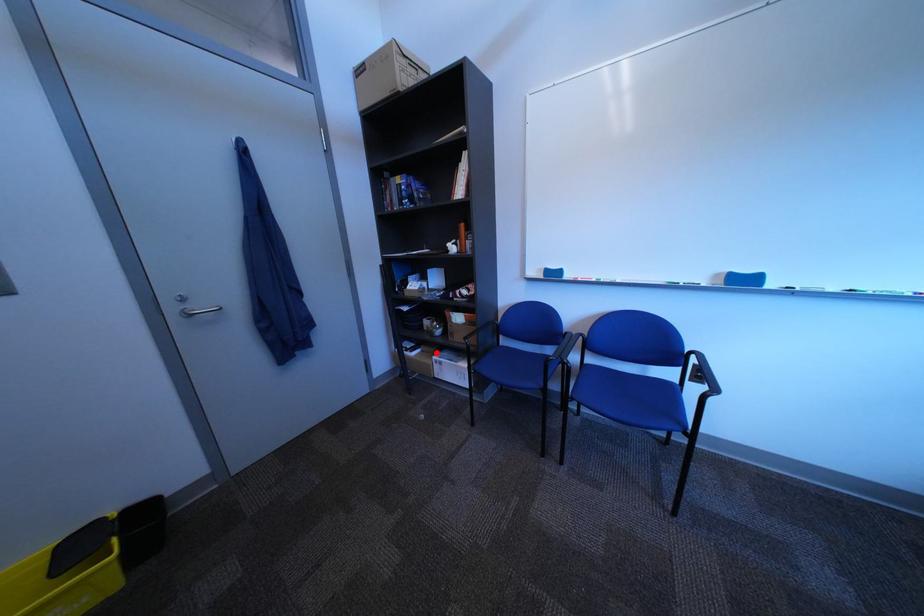
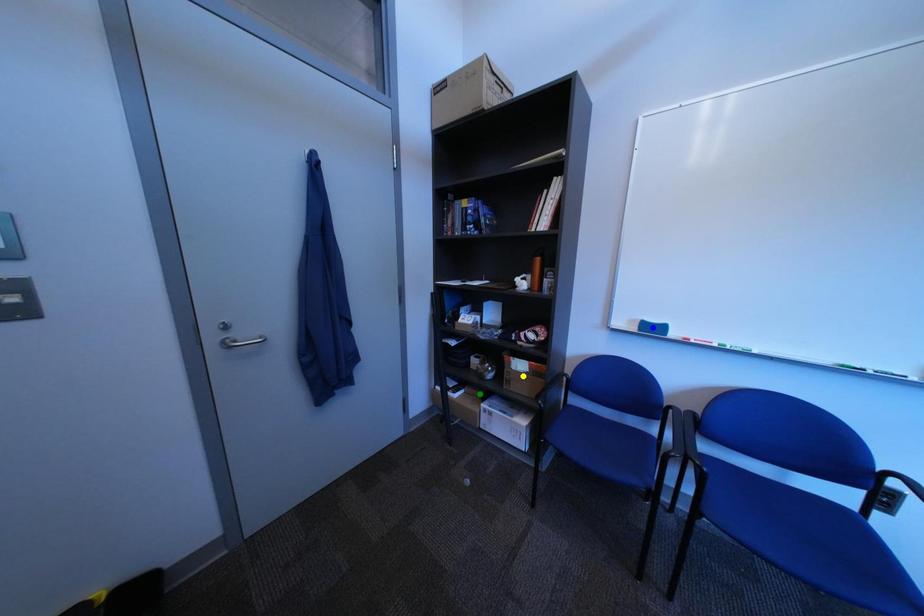
Question: I am providing you with two images of the same scene from different viewpoints. A red point is marked on the first image. You are given multiple points on the second image. Which spot in image 2 lines up with the point in image 1?

Choices:
 (A) blue point
 (B) green point
 (C) yellow point

Answer: (B)